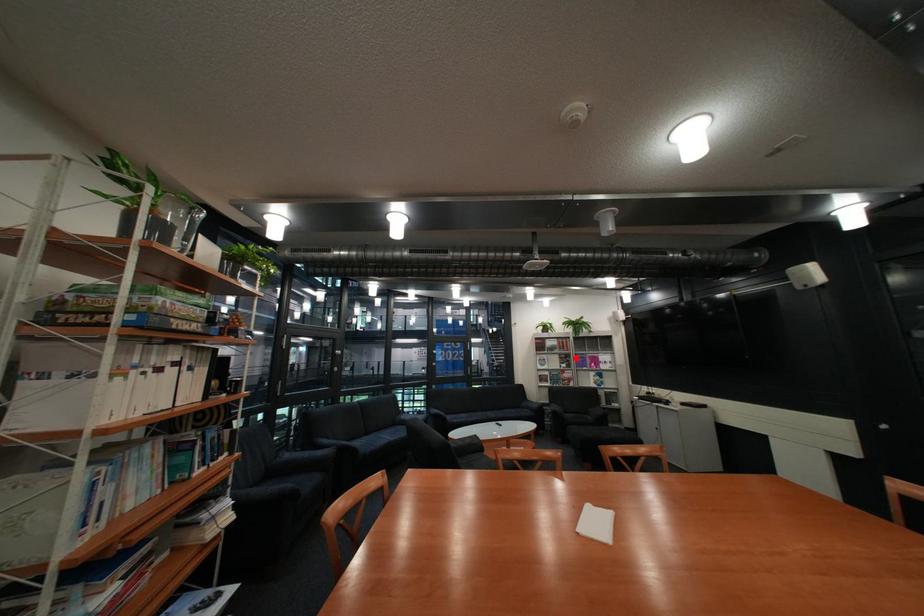
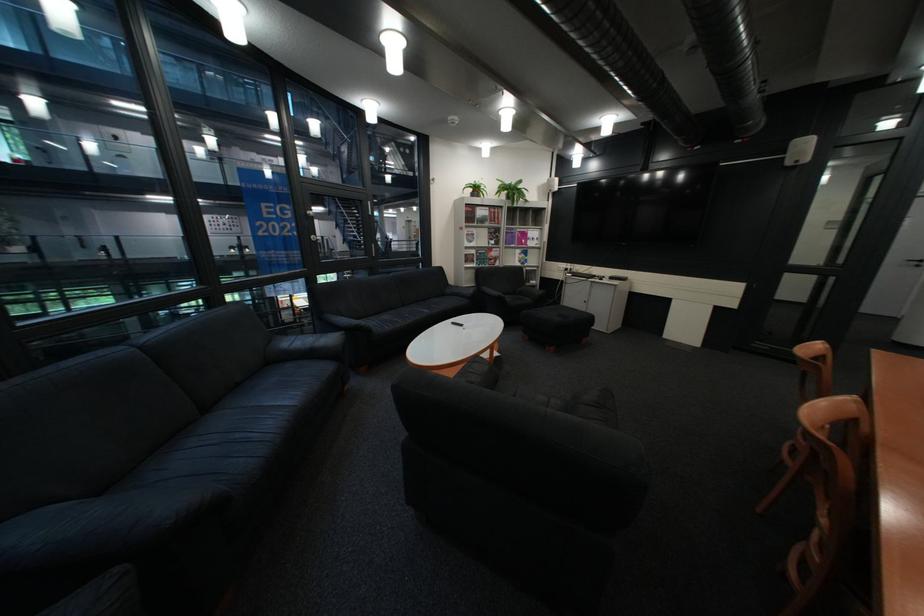
Question: A red point is marked in image1. In image2, is the corresponding 3D point closer to the camera or farther? Reply with the corresponding letter.

Choices:
 (A) The corresponding 3D point is closer.
 (B) The corresponding 3D point is farther.

Answer: (A)